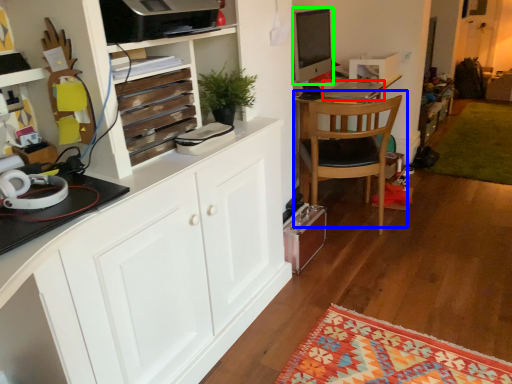
Question: Which object is positioned closest to laptop (highlighted by a red box)? Select from chair (highlighted by a blue box) and desktop computer (highlighted by a green box).

Choices:
 (A) chair
 (B) desktop computer

Answer: (A)